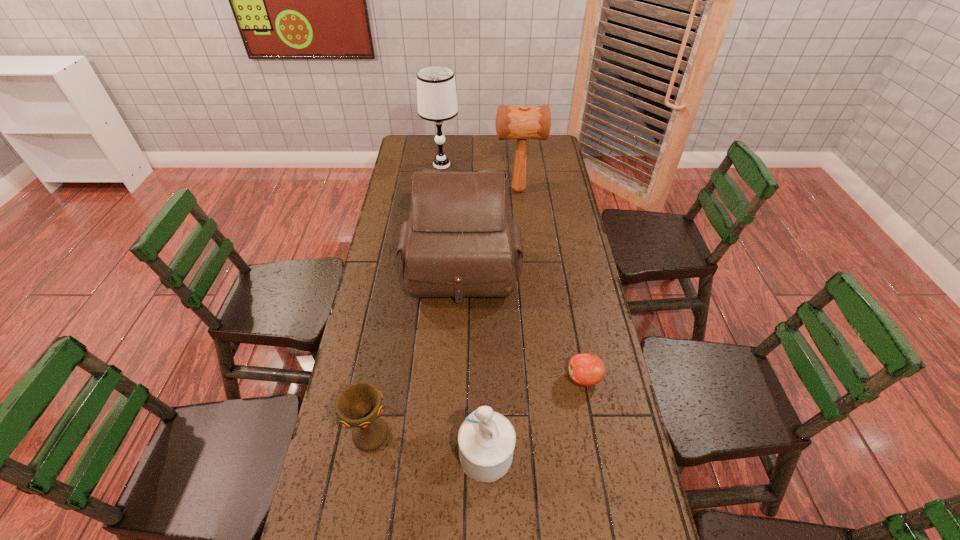
Locate an element on the screen. table lamp is located at coordinates (436, 91).

Locate an element on the screen. The image size is (960, 540). the fifth nearest object is located at coordinates (x=526, y=122).

The width and height of the screenshot is (960, 540). I want to click on the third farthest object, so click(460, 240).

The image size is (960, 540). In order to click on figurine in this screenshot , I will do click(486, 439).

Where is `the fifth tallest object`? The width and height of the screenshot is (960, 540). the fifth tallest object is located at coordinates (359, 405).

Where is `apple`? The image size is (960, 540). apple is located at coordinates point(585,369).

This screenshot has height=540, width=960. In order to click on the shortest object in this screenshot , I will do `click(585, 369)`.

Where is `free space located 0.060m on the left of the table lamp`? This screenshot has width=960, height=540. free space located 0.060m on the left of the table lamp is located at coordinates (411, 165).

This screenshot has height=540, width=960. Find the location of `vacant space positioned 0.270m on the strike surface of the fifth nearest object`. vacant space positioned 0.270m on the strike surface of the fifth nearest object is located at coordinates (432, 190).

Locate an element on the screen. The width and height of the screenshot is (960, 540). free point located on the strike surface of the fifth nearest object is located at coordinates pyautogui.click(x=427, y=190).